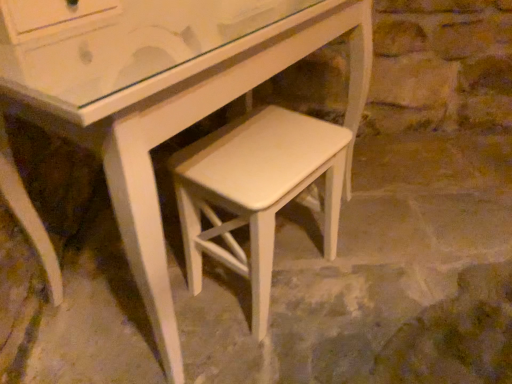
Question: Is white painted wood stool at center not inside white matte stool at center?

Choices:
 (A) yes
 (B) no

Answer: (A)

Question: From the image's perspective, is white painted wood stool at center beneath white matte stool at center?

Choices:
 (A) no
 (B) yes

Answer: (B)

Question: Does white painted wood stool at center lie in front of white matte stool at center?

Choices:
 (A) no
 (B) yes

Answer: (A)

Question: Can you confirm if white painted wood stool at center is positioned to the right of white matte stool at center?

Choices:
 (A) yes
 (B) no

Answer: (A)

Question: Can you confirm if white painted wood stool at center is shorter than white matte stool at center?

Choices:
 (A) no
 (B) yes

Answer: (B)

Question: From a real-world perspective, is white painted wood stool at center beneath white matte stool at center?

Choices:
 (A) yes
 (B) no

Answer: (A)

Question: Is white matte stool at center behind white painted wood stool at center?

Choices:
 (A) no
 (B) yes

Answer: (A)

Question: From the image's perspective, is white matte stool at center under white painted wood stool at center?

Choices:
 (A) no
 (B) yes

Answer: (A)

Question: Does white matte stool at center turn towards white painted wood stool at center?

Choices:
 (A) no
 (B) yes

Answer: (A)

Question: From a real-world perspective, is white matte stool at center on top of white painted wood stool at center?

Choices:
 (A) no
 (B) yes

Answer: (B)

Question: Could white painted wood stool at center be considered to be inside white matte stool at center?

Choices:
 (A) yes
 (B) no

Answer: (B)

Question: Does white matte stool at center have a lesser width compared to white painted wood stool at center?

Choices:
 (A) no
 (B) yes

Answer: (B)

Question: From the image's perspective, is white matte stool at center above or below white painted wood stool at center?

Choices:
 (A) below
 (B) above

Answer: (B)